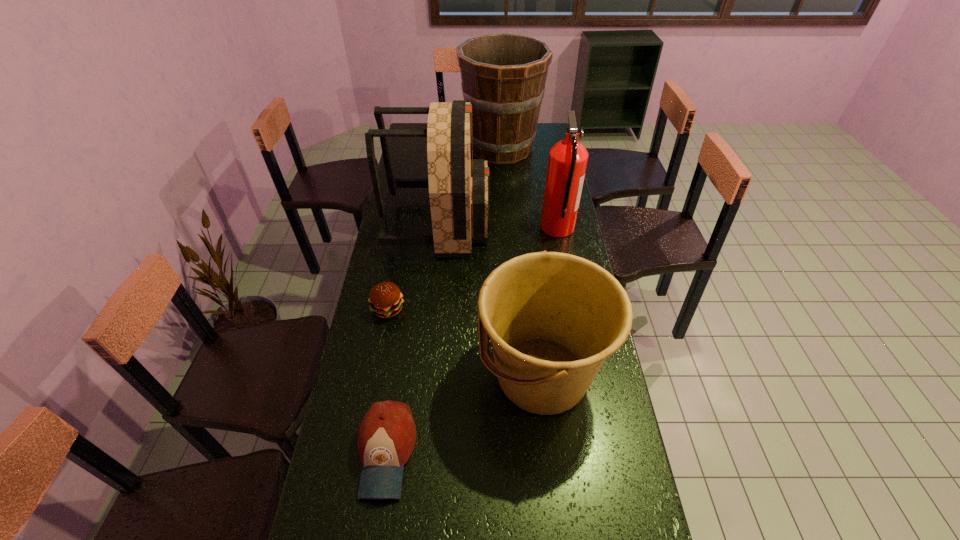
Locate an element on the screen. The image size is (960, 540). backpack is located at coordinates (458, 185).

Where is `the farther bucket`? the farther bucket is located at coordinates (503, 75).

At what (x,y) coordinates should I click in order to perform the action: click on the taller bucket. Please return your answer as a coordinate pair (x, y). The height and width of the screenshot is (540, 960). Looking at the image, I should click on (503, 75).

Identify the location of fire extinguisher. The width and height of the screenshot is (960, 540). coord(567,162).

Locate an element on the screen. the third shortest object is located at coordinates (553, 318).

Find the location of `the shorter bucket`. the shorter bucket is located at coordinates (553, 318).

Identify the location of baseball cap. This screenshot has width=960, height=540. (387, 434).

This screenshot has width=960, height=540. What are the coordinates of `hamburger` in the screenshot? It's located at (385, 298).

Where is `free region located on the front face of the backpack`? free region located on the front face of the backpack is located at coordinates (505, 224).

Identify the location of free spot located on the front of the farthest object. The width and height of the screenshot is (960, 540). (504, 200).